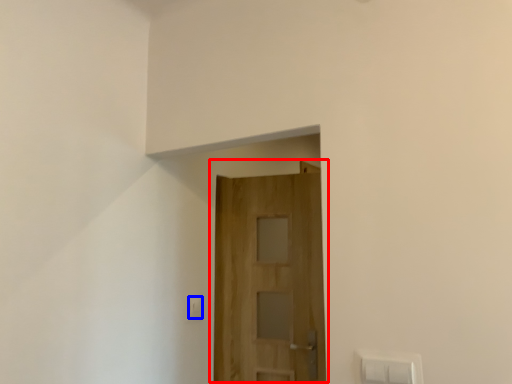
Question: Which of the following is the farthest to the observer, door (highlighted by a red box) or light switch (highlighted by a blue box)?

Choices:
 (A) door
 (B) light switch

Answer: (B)